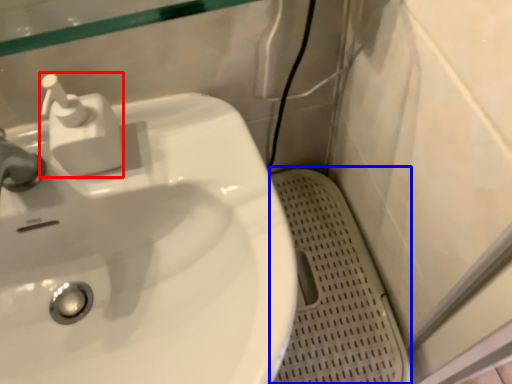
Question: Among these objects, which one is farthest to the camera, soap dispenser (highlighted by a red box) or porcelain (highlighted by a blue box)?

Choices:
 (A) soap dispenser
 (B) porcelain

Answer: (B)